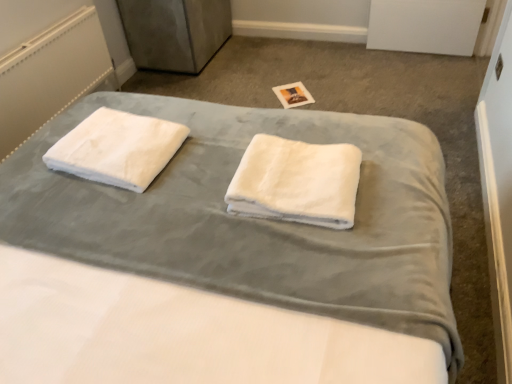
Locate an element on the screen. Image resolution: width=512 pixels, height=384 pixels. free location above white soft towel at left, which is the 2th towel from right to left (from a real-world perspective) is located at coordinates (109, 135).